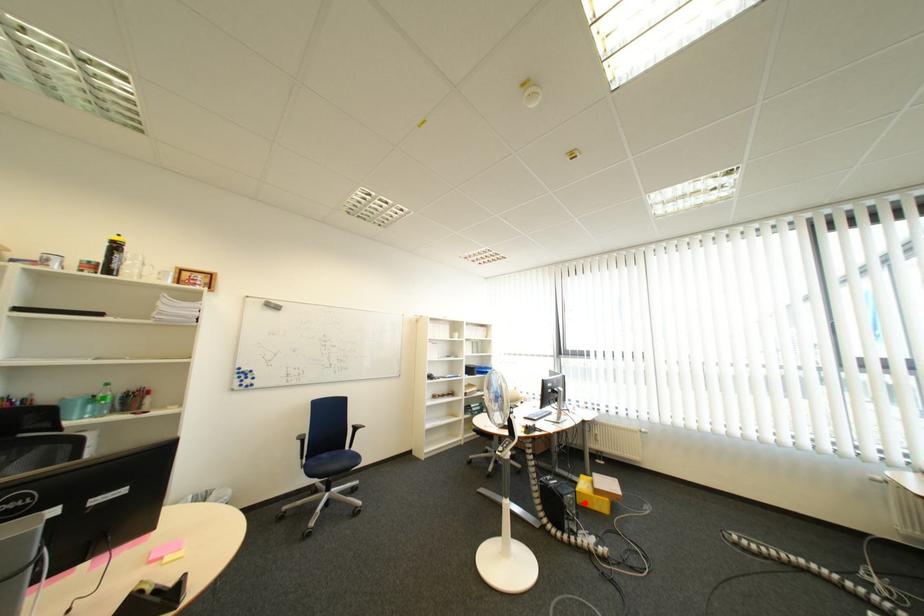
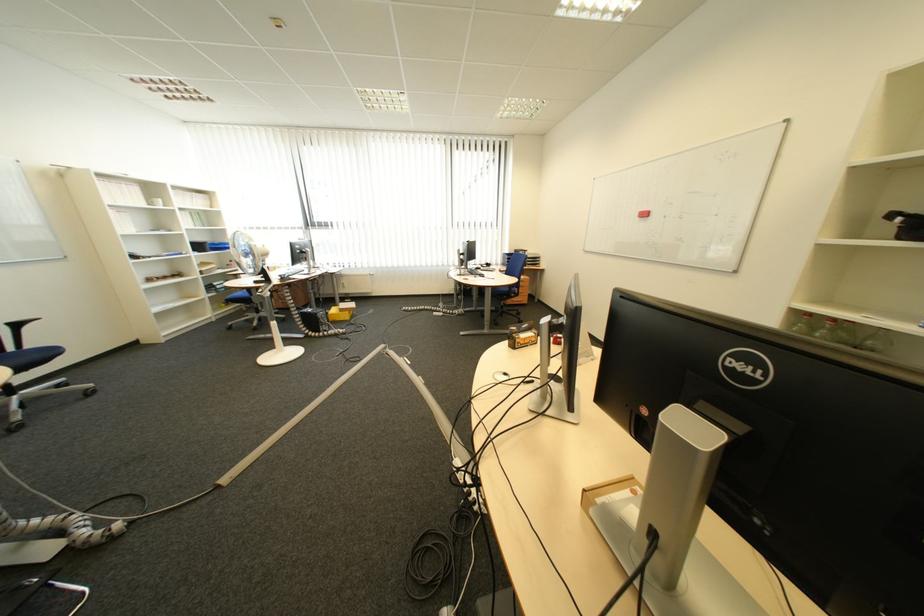
Locate, in the second image, the point that corresponds to the highlighted location in the first image.

(335, 317)